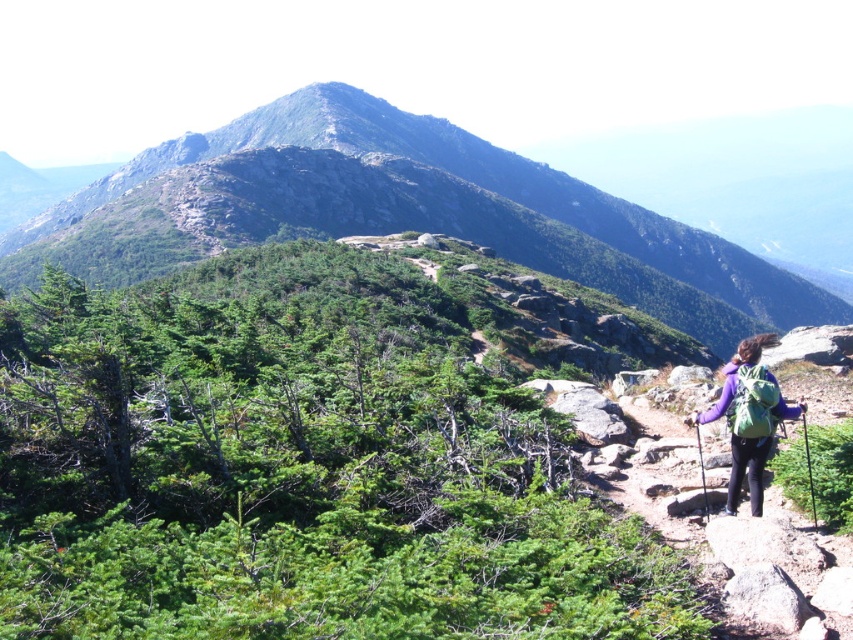
You are a hiker who wants to place your purple fabric backpack at lower right on the ground near the green rocky mountain at center. Based on the scene, can you safely put it there?

The purple fabric backpack at lower right is behind green rocky mountain at center, so it is not visible from the current viewpoint. Therefore, you cannot safely place it there as you cannot see the location.

You are a hiker standing at the start of the trail and see the green rocky mountain at center and the purple fabric backpack at lower right. Which object is located to the left of the other?

The green rocky mountain at center is positioned on the left side of purple fabric backpack at lower right.

You are standing at the starting point of the hiking trail in the scenic mountainous landscape. You notice the green rocky mountain at center. Based on its coordinates, which direction should you head to reach it?

The green rocky mountain at center is located at coordinates point (402, 212), so you should head towards the center of the image to reach it.